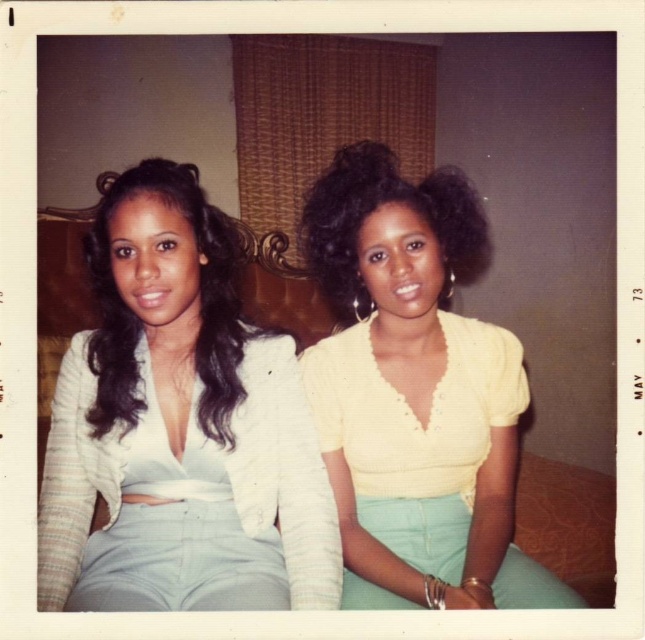
Does black silky hair at left have a smaller size compared to curly black hair at center?

Yes, black silky hair at left is smaller than curly black hair at center.

Can you confirm if black silky hair at left is positioned to the left of curly black hair at center?

Indeed, black silky hair at left is positioned on the left side of curly black hair at center.

What do you see at coordinates (144, 321) in the screenshot?
I see `black silky hair at left` at bounding box center [144, 321].

I want to click on black silky hair at left, so coord(144,321).

Does yellow knitted top at center have a greater width compared to black silky hair at left?

Yes.

At what (x,y) coordinates should I click in order to perform the action: click on yellow knitted top at center. Please return your answer as a coordinate pair (x, y). This screenshot has width=645, height=640. Looking at the image, I should click on (415, 394).

How much distance is there between yellow knitted top at center and curly black hair at center?

A distance of 6.53 inches exists between yellow knitted top at center and curly black hair at center.

Between point (501, 355) and point (444, 186), which one is positioned behind?

The point (501, 355) is more distant.

Does point (524, 410) come behind point (372, 204)?

That is True.

Locate an element on the screen. The height and width of the screenshot is (640, 645). yellow knitted top at center is located at coordinates tap(415, 394).